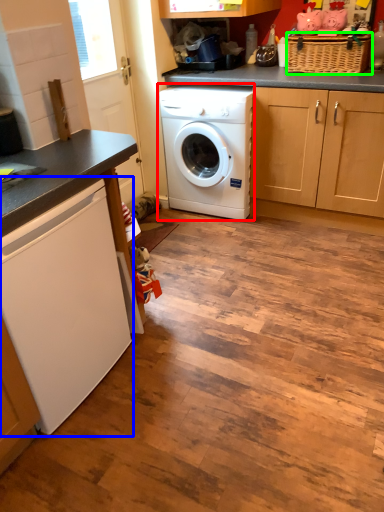
Question: Estimate the real-world distances between objects in this image. Which object is closer to washing machine (highlighted by a red box), washing machine (highlighted by a blue box) or basket (highlighted by a green box)?

Choices:
 (A) washing machine
 (B) basket

Answer: (B)